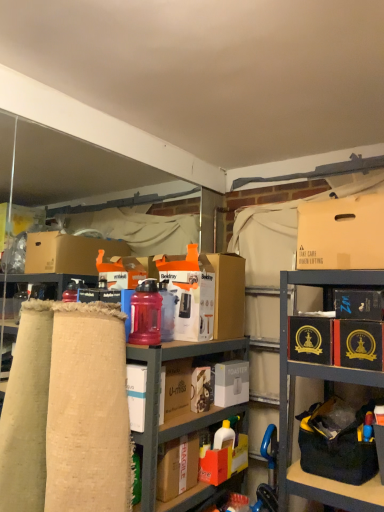
Question: Looking at the image, does black cardboard box at upper right, which ranks as the fifth box in bottom-to-top order, seem bigger or smaller compared to white cardboard box at center, positioned as the 6th box in bottom-to-top order?

Choices:
 (A) big
 (B) small

Answer: (B)

Question: From the image's perspective, is black cardboard box at upper right, which ranks as the fifth box in bottom-to-top order, positioned above or below white cardboard box at center, positioned as the 6th box in bottom-to-top order?

Choices:
 (A) below
 (B) above

Answer: (A)

Question: Which of these objects is positioned closest to the translucent plastic water bottle at center?

Choices:
 (A) black fabric bag at lower right
 (B) white cardboard box at center
 (C) black cardboard box at center-right, marked as the 3th box in a bottom-to-top arrangement
 (D) translucent plastic bottle at center
 (E) black cardboard box at upper right, placed as the 3th box when sorted from top to bottom

Answer: (B)

Question: Which object is positioned closest to the matte cardboard box at upper right, which is counted as the first box, starting from the top?

Choices:
 (A) translucent plastic bottle at center
 (B) burlap fabric at left
 (C) white cardboard box at center, the 6th box from the top
 (D) white cardboard box at center
 (E) matte cardboard boxes at center, marked as the 1th cabinetry in a top-to-bottom arrangement

Answer: (D)